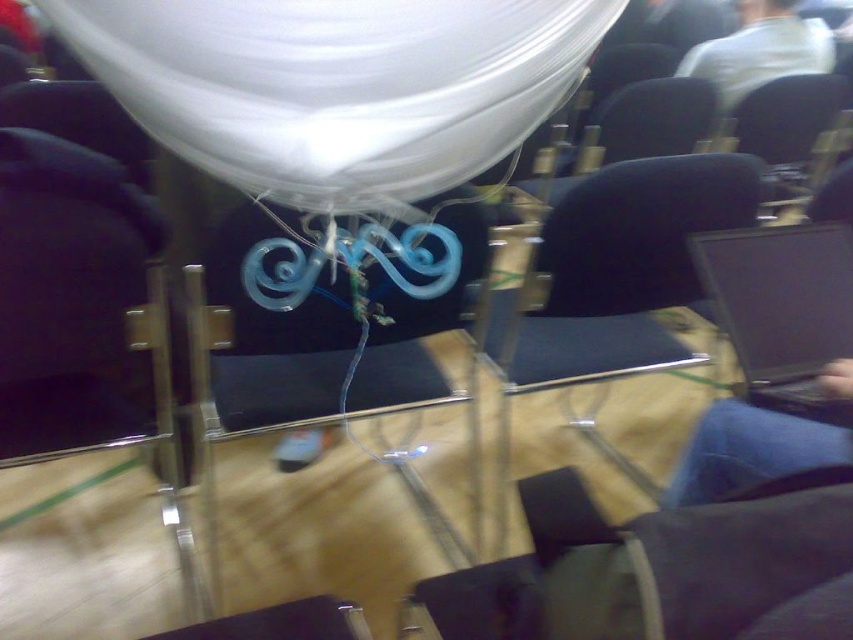
Consider the image. You are setting up a presentation in the conference room and need to place a projector between the black fabric chair at center and the black glossy laptop at center. Based on their positions, which side of the laptop should you place the projector on?

The black fabric chair at center is to the left of the black glossy laptop at center, so you should place the projector to the right side of the laptop.

You are an event planner setting up for a presentation. You need to ensure that the white glossy balloon at upper center and the black fabric armchair at left are visible to the audience. Given their sizes, which object might block the view of the other if placed in front?

The white glossy balloon at upper center is wider than the black fabric armchair at left, so if placed in front, it could potentially block the view of the black fabric armchair at left.

You are standing in the conference room and need to place a small plant exactly at point [610,289]. Which object is already at that location?

The black fabric chair at center is located at point [610,289], so the plant cannot be placed there as the chair is already occupying that spot.